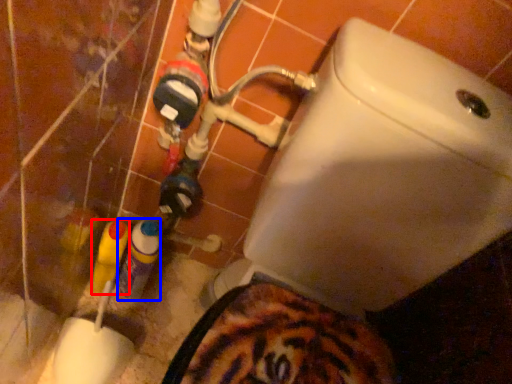
Question: Which object is further to the camera taking this photo, bottle (highlighted by a red box) or bottle (highlighted by a blue box)?

Choices:
 (A) bottle
 (B) bottle

Answer: (B)